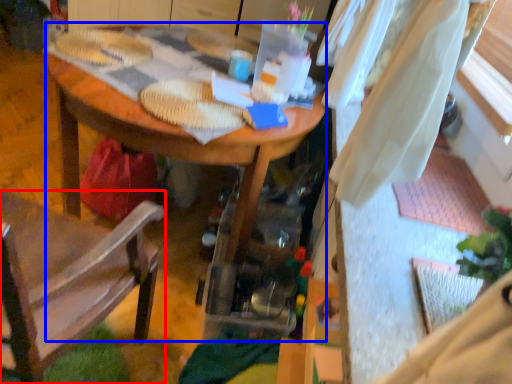
Question: Which object is closer to the camera taking this photo, chair (highlighted by a red box) or desk (highlighted by a blue box)?

Choices:
 (A) chair
 (B) desk

Answer: (A)